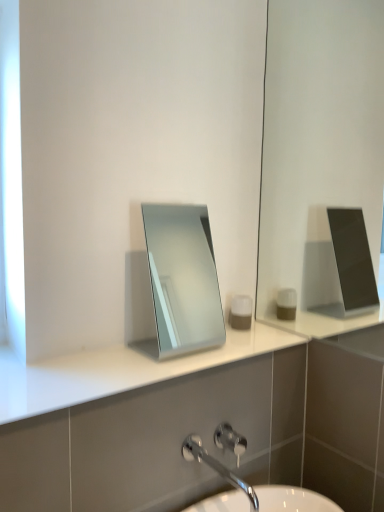
Locate an element on the screen. vacant area that lies between matte gray container at center and silver metallic mirror at center is located at coordinates coord(225,340).